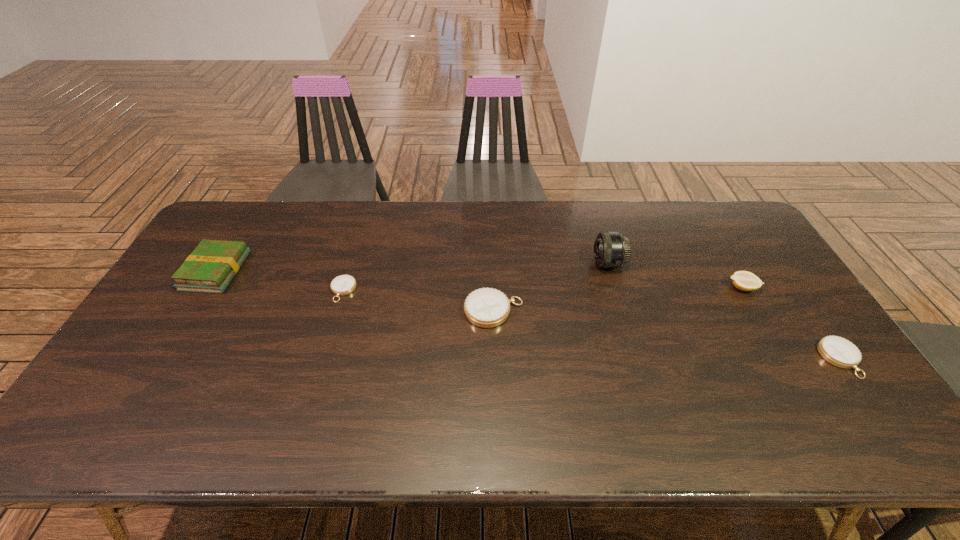
Identify which object is the nearest to the fourth object from left to right. Please provide its 2D coordinates. Your answer should be formatted as a tuple, i.e. [(x, y)], where the tuple contains the x and y coordinates of a point satisfying the conditions above.

[(486, 307)]

Choose which object is the second nearest neighbor to the shortest object. Please provide its 2D coordinates. Your answer should be formatted as a tuple, i.e. [(x, y)], where the tuple contains the x and y coordinates of a point satisfying the conditions above.

[(486, 307)]

Locate which compass is the closest to the fourth shortest object. Please provide its 2D coordinates. Your answer should be formatted as a tuple, i.e. [(x, y)], where the tuple contains the x and y coordinates of a point satisfying the conditions above.

[(838, 351)]

The height and width of the screenshot is (540, 960). Identify the location of the second closest compass to the shortest compass. (838, 351).

This screenshot has width=960, height=540. I want to click on blank area in the image that satisfies the following two spatial constraints: 1. on the front-facing side of the tallest object; 2. on the right side of the second object from right to left, so click(615, 288).

At what (x,y) coordinates should I click in order to perform the action: click on blank area in the image that satisfies the following two spatial constraints: 1. on the front side of the leftmost compass; 2. on the right side of the third shortest object. Please return your answer as a coordinate pair (x, y). Image resolution: width=960 pixels, height=540 pixels. Looking at the image, I should click on (337, 311).

I want to click on free location that satisfies the following two spatial constraints: 1. on the front-facing side of the fourth shortest object; 2. on the left side of the telephoto lens, so click(615, 288).